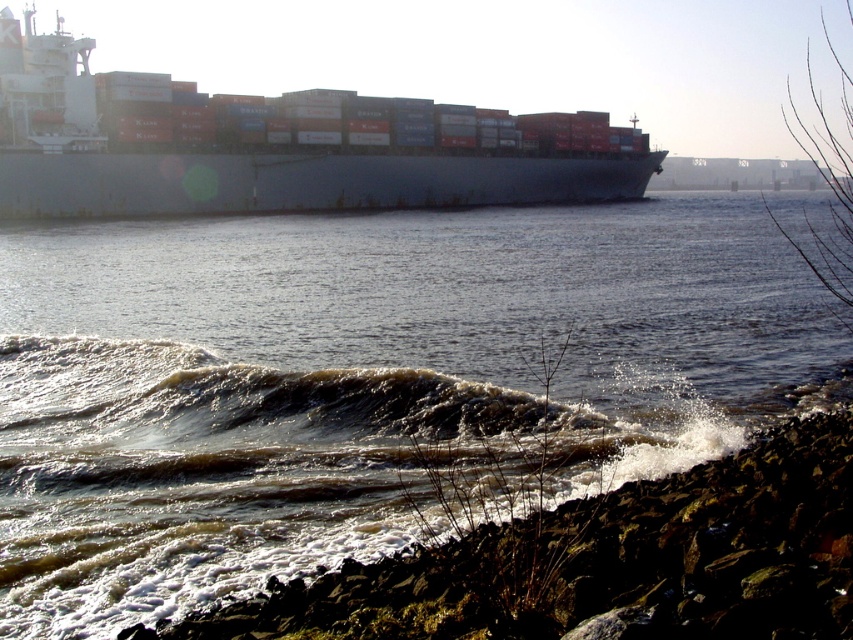
Question: Which object is closer to the camera taking this photo?

Choices:
 (A) brown/foamy water at center
 (B) metallic gray ship at upper left

Answer: (A)

Question: Does brown/foamy water at center appear over metallic gray ship at upper left?

Choices:
 (A) no
 (B) yes

Answer: (A)

Question: Can you confirm if brown/foamy water at center is wider than metallic gray ship at upper left?

Choices:
 (A) yes
 (B) no

Answer: (A)

Question: Is brown/foamy water at center closer to the viewer compared to metallic gray ship at upper left?

Choices:
 (A) yes
 (B) no

Answer: (A)